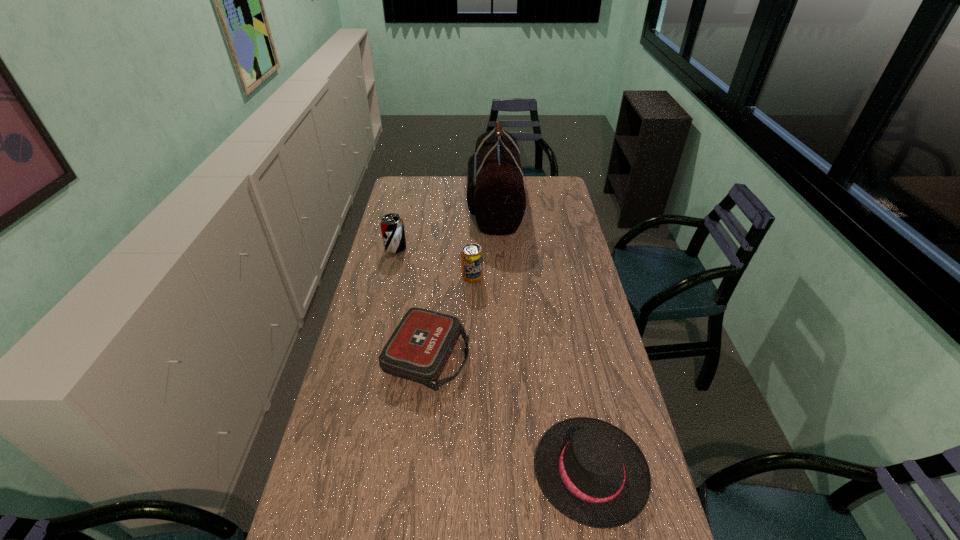
You are a GUI agent. You are given a task and a screenshot of the screen. Output one action in this format:
    pyautogui.click(x=<x>, y=<y>)
    Task: Click on the duffel bag
    
    Given the screenshot: What is the action you would take?
    pyautogui.click(x=495, y=193)

Image resolution: width=960 pixels, height=540 pixels. Identify the location of the tallest object. (495, 193).

Identify the location of the fourth nearest object. (392, 227).

Where is `the left soda can`? the left soda can is located at coordinates (392, 227).

Find the location of a particular element. Image resolution: width=960 pixels, height=540 pixels. the nearer soda can is located at coordinates (471, 255).

You are a GUI agent. You are given a task and a screenshot of the screen. Output one action in this format:
    pyautogui.click(x=<x>, y=<y>)
    Task: Click on the right soda can
    Image resolution: width=960 pixels, height=540 pixels.
    Given the screenshot: What is the action you would take?
    pyautogui.click(x=471, y=255)

Where is `the nearest object`? The height and width of the screenshot is (540, 960). the nearest object is located at coordinates (591, 471).

This screenshot has height=540, width=960. I want to click on the shortest object, so click(418, 350).

At what (x,y) coordinates should I click in order to perform the action: click on the fourth farthest object. Please return your answer as a coordinate pair (x, y). This screenshot has width=960, height=540. Looking at the image, I should click on (418, 350).

You are a GUI agent. You are given a task and a screenshot of the screen. Output one action in this format:
    pyautogui.click(x=<x>, y=<y>)
    Task: Click on the blank space located 0.100m on the front pocket of the tallest object
    The height and width of the screenshot is (540, 960).
    Given the screenshot: What is the action you would take?
    pyautogui.click(x=446, y=205)